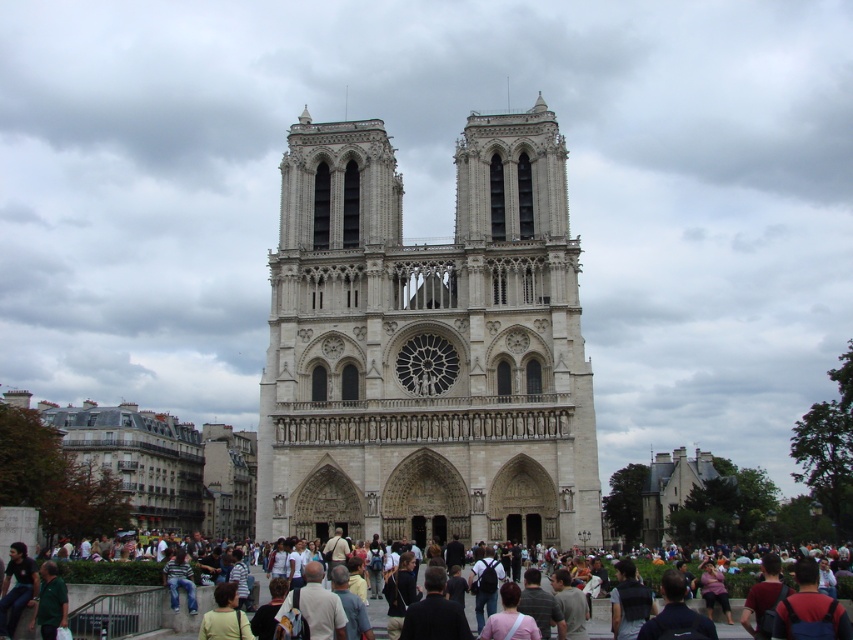
In the scene shown: Who is taller, white stone cathedral at center or dark gray clothing at center?

white stone cathedral at center is taller.

Can you confirm if white stone cathedral at center is shorter than dark gray clothing at center?

No, white stone cathedral at center is not shorter than dark gray clothing at center.

Which is in front, point (381, 314) or point (163, 627)?

Point (163, 627) is in front.

What are the coordinates of `white stone cathedral at center` in the screenshot? It's located at (427, 346).